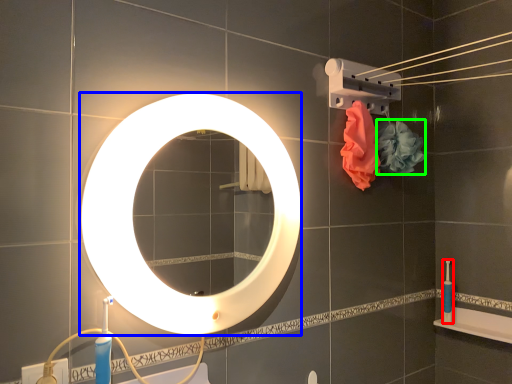
Question: Which is nearer to the toiletry (highlighted by a red box)? mirror (highlighted by a blue box) or flower (highlighted by a green box).

Choices:
 (A) mirror
 (B) flower

Answer: (B)